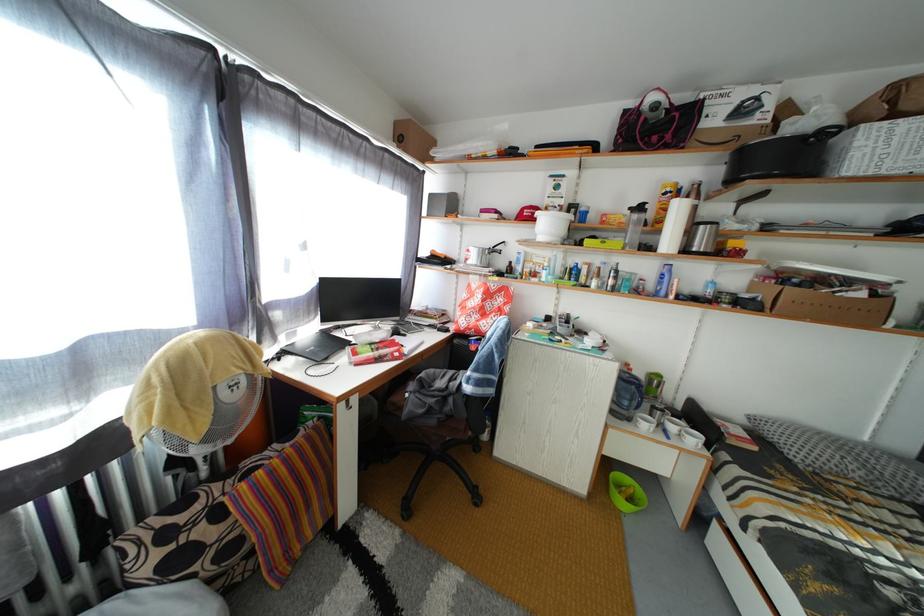
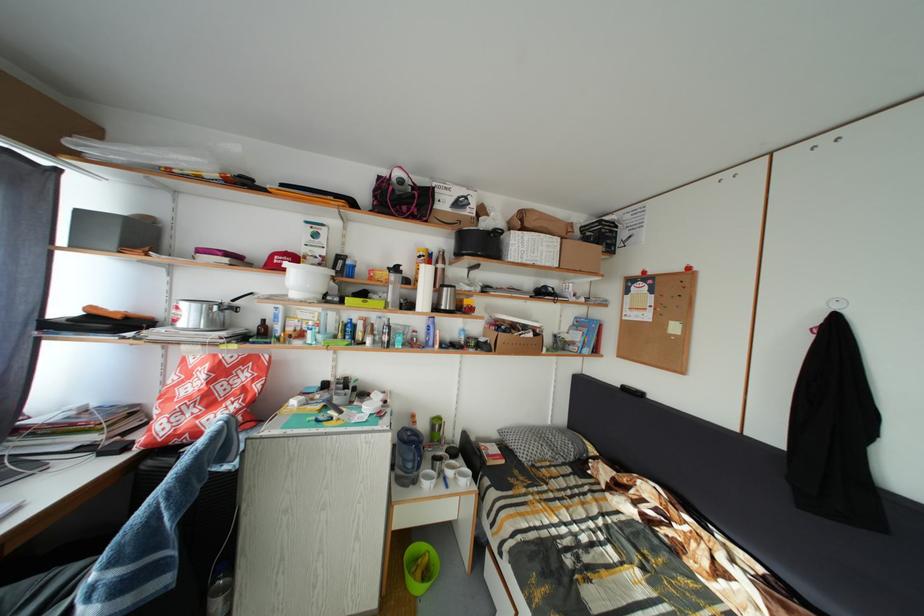
In the second image, find the point that corresponds to point (520, 214) in the first image.

(265, 257)